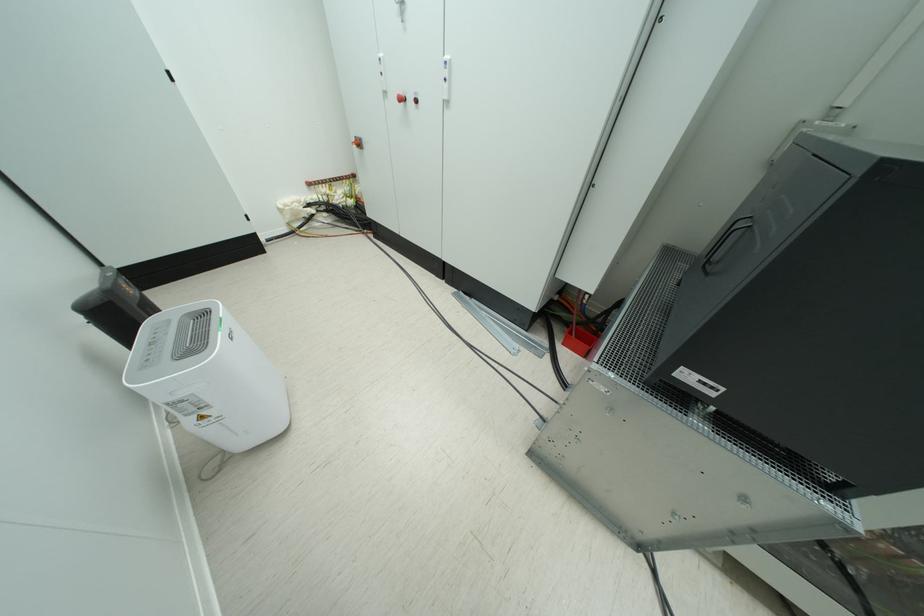
In order to click on black case handle in this screenshot , I will do `click(725, 238)`.